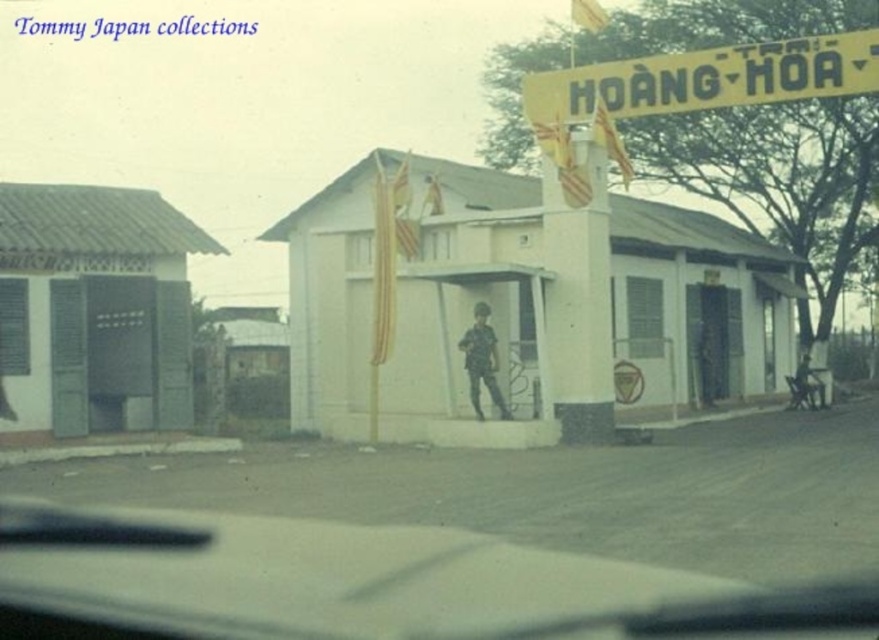
Between point (306, 604) and point (678, 108), which one is positioned behind?

The point (678, 108) is more distant.

Between transparent glass windshield at center and yellow paper banner at upper center, which one appears on the left side from the viewer's perspective?

Positioned to the left is transparent glass windshield at center.

Describe the element at coordinates (367, 584) in the screenshot. I see `transparent glass windshield at center` at that location.

Identify the location of transparent glass windshield at center. (367, 584).

Does point (662, 108) come behind point (469, 371)?

No, (662, 108) is closer to viewer.

In the scene shown: Can you confirm if yellow paper banner at upper center is shorter than camouflage fabric uniform at center?

No.

Between point (569, 108) and point (499, 403), which one is positioned behind?

Point (569, 108)

Where is `yellow paper banner at upper center`? This screenshot has width=879, height=640. yellow paper banner at upper center is located at coordinates (706, 77).

Who is more distant from viewer, (82, 577) or (478, 358)?

Positioned behind is point (478, 358).

Can you confirm if transparent glass windshield at center is wider than camouflage fabric uniform at center?

Yes, transparent glass windshield at center is wider than camouflage fabric uniform at center.

Measure the distance between transparent glass windshield at center and camera.

transparent glass windshield at center and camera are 7.08 meters apart from each other.

You are a GUI agent. You are given a task and a screenshot of the screen. Output one action in this format:
    pyautogui.click(x=<x>, y=<y>)
    Task: Click on the transparent glass windshield at center
    
    Given the screenshot: What is the action you would take?
    pyautogui.click(x=367, y=584)